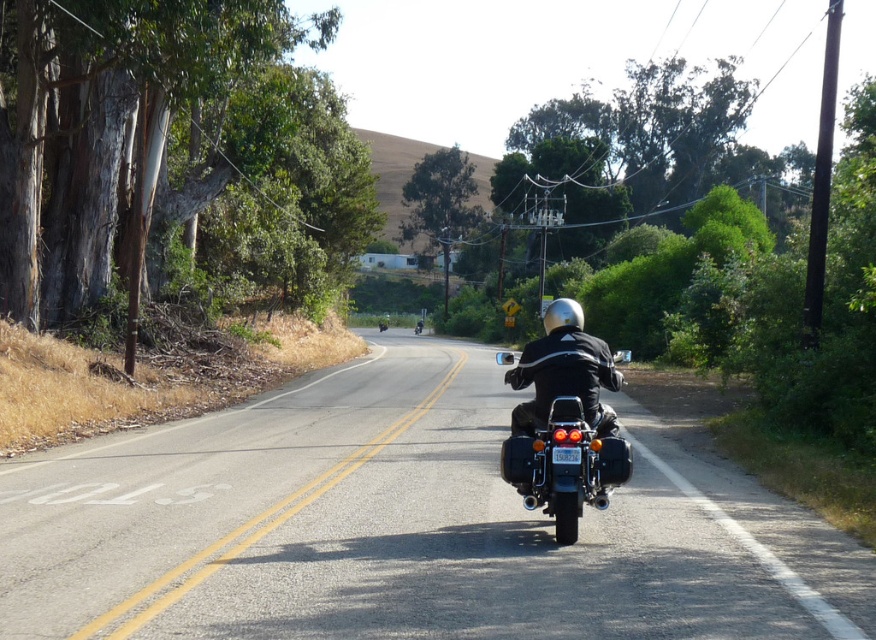
Between black asphalt road at center and black leather jacket at center, which one appears on the right side from the viewer's perspective?

black leather jacket at center is more to the right.

This screenshot has width=876, height=640. Describe the element at coordinates (401, 525) in the screenshot. I see `black asphalt road at center` at that location.

Image resolution: width=876 pixels, height=640 pixels. What are the coordinates of `black asphalt road at center` in the screenshot? It's located at (401, 525).